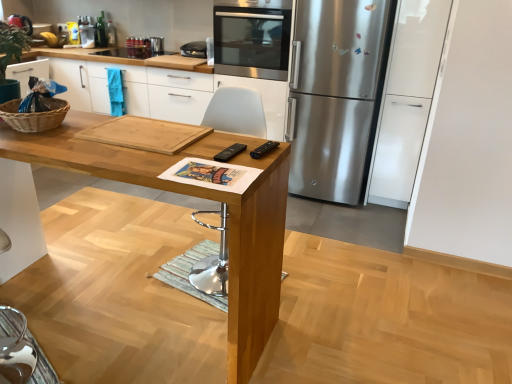
Question: Should I look upward or downward to see stainless steel oven at upper center?

Choices:
 (A) up
 (B) down

Answer: (A)

Question: Is white plastic chair at center thinner than stainless steel oven at upper center?

Choices:
 (A) no
 (B) yes

Answer: (B)

Question: Can you confirm if white plastic chair at center is bigger than stainless steel oven at upper center?

Choices:
 (A) no
 (B) yes

Answer: (A)

Question: Is white plastic chair at center taller than stainless steel oven at upper center?

Choices:
 (A) yes
 (B) no

Answer: (A)

Question: From a real-world perspective, is white plastic chair at center located beneath stainless steel oven at upper center?

Choices:
 (A) no
 (B) yes

Answer: (B)

Question: Is stainless steel oven at upper center surrounded by white plastic chair at center?

Choices:
 (A) no
 (B) yes

Answer: (A)

Question: Are white plastic chair at center and stainless steel oven at upper center located far from each other?

Choices:
 (A) no
 (B) yes

Answer: (B)

Question: Can you confirm if natural wood cutting board at center is wider than woven brown basket at left?

Choices:
 (A) yes
 (B) no

Answer: (A)

Question: Could woven brown basket at left be considered to be inside natural wood cutting board at center?

Choices:
 (A) no
 (B) yes

Answer: (A)

Question: Is natural wood cutting board at center completely or partially outside of woven brown basket at left?

Choices:
 (A) no
 (B) yes

Answer: (B)

Question: From the image's perspective, is natural wood cutting board at center located beneath woven brown basket at left?

Choices:
 (A) yes
 (B) no

Answer: (B)

Question: Considering the relative sizes of natural wood cutting board at center and woven brown basket at left in the image provided, is natural wood cutting board at center taller than woven brown basket at left?

Choices:
 (A) no
 (B) yes

Answer: (B)

Question: From a real-world perspective, is natural wood cutting board at center below woven brown basket at left?

Choices:
 (A) yes
 (B) no

Answer: (A)

Question: Is woven brown basket at left positioned with its back to white plastic chair at center?

Choices:
 (A) no
 (B) yes

Answer: (A)